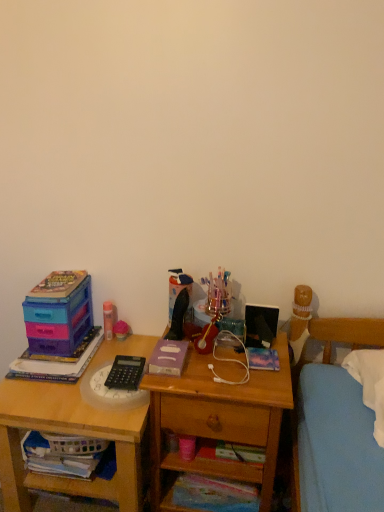
Where is `free space in front of metallic blue book at center, which appears as the 2th book when viewed from the top`? This screenshot has height=512, width=384. free space in front of metallic blue book at center, which appears as the 2th book when viewed from the top is located at coordinates (256, 381).